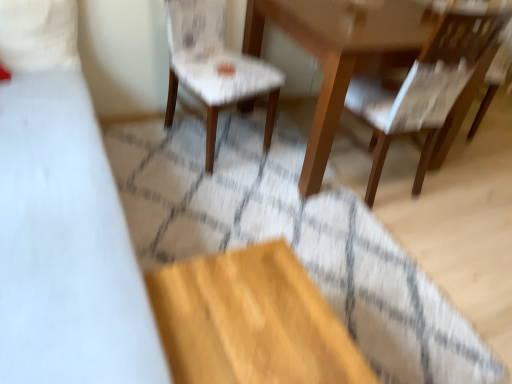
At what (x,y) coordinates should I click in order to perform the action: click on wooden chair at right, which ranks as the 1th chair in right-to-left order. Please return your answer as a coordinate pair (x, y). Image resolution: width=512 pixels, height=384 pixels. Looking at the image, I should click on (423, 88).

Measure the distance between point (x=461, y=55) and camera.

Point (x=461, y=55) is 1.72 meters away from camera.

Locate an element on the screen. matte yellow plywood at lower center is located at coordinates (250, 321).

Is matte yellow plywood at lower center aimed at white fabric chair at center, acting as the second chair starting from the right?

No.

Which is correct: matte yellow plywood at lower center is inside white fabric chair at center, which is the first chair from left to right, or outside of it?

matte yellow plywood at lower center lies outside white fabric chair at center, which is the first chair from left to right.

What's the angular difference between matte yellow plywood at lower center and white fabric chair at center, which is the first chair from left to right,'s facing directions?

matte yellow plywood at lower center and white fabric chair at center, which is the first chair from left to right, are facing 77.6 degrees away from each other.

Is point (188, 293) farther from camera compared to point (213, 59)?

No, it is not.

Does point (412, 36) come behind point (256, 350)?

Yes, point (412, 36) is behind point (256, 350).

I want to click on round table that appears above the matte yellow plywood at lower center (from a real-world perspective), so click(339, 54).

Does wooden table at center turn towards matte yellow plywood at lower center?

No.

How much distance is there between wooden table at center and matte yellow plywood at lower center?

wooden table at center and matte yellow plywood at lower center are 1.04 meters apart.

Is wooden table at center aimed at white fabric chair at center, which is the first chair from left to right?

No, wooden table at center is not facing towards white fabric chair at center, which is the first chair from left to right.

Which point is more forward, (354, 5) or (213, 94)?

The point (213, 94) is more forward.

Can we say wooden table at center lies outside white fabric chair at center, acting as the second chair starting from the right?

Absolutely, wooden table at center is external to white fabric chair at center, acting as the second chair starting from the right.

Are white fabric bed at left and matte yellow plywood at lower center beside each other?

No.

Is white fabric bed at left inside or outside of matte yellow plywood at lower center?

white fabric bed at left is located beyond the bounds of matte yellow plywood at lower center.

Between white fabric bed at left and matte yellow plywood at lower center, which one has smaller size?

Smaller between the two is matte yellow plywood at lower center.

Considering the positions of objects white fabric bed at left and matte yellow plywood at lower center in the image provided, who is more to the right, white fabric bed at left or matte yellow plywood at lower center?

Positioned to the right is matte yellow plywood at lower center.

Is point (420, 175) closer or farther from the camera than point (110, 308)?

Point (420, 175) is farther from the camera than point (110, 308).

Is wooden chair at right, which ranks as the 1th chair in right-to-left order, facing away from white fabric bed at left?

No, wooden chair at right, which ranks as the 1th chair in right-to-left order,'s orientation is not away from white fabric bed at left.

From a real-world perspective, which is physically above, wooden chair at right, which ranks as the 1th chair in right-to-left order, or white fabric bed at left?

wooden chair at right, which ranks as the 1th chair in right-to-left order, from a real-world perspective.

Would you say wooden chair at right, marked as the 2th chair in a left-to-right arrangement, is to the left or to the right of white fabric bed at left in the picture?

Based on their positions, wooden chair at right, marked as the 2th chair in a left-to-right arrangement, is located to the right of white fabric bed at left.

From a real-world perspective, does wooden chair at right, which ranks as the 1th chair in right-to-left order, sit lower than matte yellow plywood at lower center?

No, from a real-world perspective, wooden chair at right, which ranks as the 1th chair in right-to-left order, is not below matte yellow plywood at lower center.

Does wooden chair at right, marked as the 2th chair in a left-to-right arrangement, lie in front of matte yellow plywood at lower center?

No, the depth of wooden chair at right, marked as the 2th chair in a left-to-right arrangement, is greater than that of matte yellow plywood at lower center.

Is wooden chair at right, which ranks as the 1th chair in right-to-left order, wider or thinner than matte yellow plywood at lower center?

In the image, wooden chair at right, which ranks as the 1th chair in right-to-left order, appears to be wider than matte yellow plywood at lower center.

Is wooden chair at right, which ranks as the 1th chair in right-to-left order, turned away from matte yellow plywood at lower center?

No, wooden chair at right, which ranks as the 1th chair in right-to-left order,'s orientation is not away from matte yellow plywood at lower center.

Is wooden chair at right, which ranks as the 1th chair in right-to-left order, facing away from white fabric chair at center, acting as the second chair starting from the right?

wooden chair at right, which ranks as the 1th chair in right-to-left order, is not turned away from white fabric chair at center, acting as the second chair starting from the right.

Considering their positions, is wooden chair at right, which ranks as the 1th chair in right-to-left order, located in front of or behind white fabric chair at center, which is the first chair from left to right?

Visually, wooden chair at right, which ranks as the 1th chair in right-to-left order, is located in front of white fabric chair at center, which is the first chair from left to right.

Considering the relative positions of wooden chair at right, which ranks as the 1th chair in right-to-left order, and white fabric chair at center, which is the first chair from left to right, in the image provided, is wooden chair at right, which ranks as the 1th chair in right-to-left order, to the left of white fabric chair at center, which is the first chair from left to right, from the viewer's perspective?

No.

You are a GUI agent. You are given a task and a screenshot of the screen. Output one action in this format:
    pyautogui.click(x=<x>, y=<y>)
    Task: Click on the 2nd chair behind the matte yellow plywood at lower center, starting your count from the anchor
    This screenshot has width=512, height=384.
    Given the screenshot: What is the action you would take?
    pyautogui.click(x=214, y=67)

Where is `plywood on the left side of wooden table at center`? This screenshot has width=512, height=384. plywood on the left side of wooden table at center is located at coordinates (250, 321).

In the scene shown: From the image, which object appears to be nearer to wooden chair at right, marked as the 2th chair in a left-to-right arrangement, matte yellow plywood at lower center or wooden table at center?

wooden table at center is closer to wooden chair at right, marked as the 2th chair in a left-to-right arrangement.

Looking at the image, which one is located closer to white fabric bed at left, white fabric chair at center, acting as the second chair starting from the right, or wooden chair at right, which ranks as the 1th chair in right-to-left order?

The object closer to white fabric bed at left is white fabric chair at center, acting as the second chair starting from the right.

Considering their positions, is white fabric bed at left positioned closer to wooden table at center than matte yellow plywood at lower center?

The object closer to wooden table at center is matte yellow plywood at lower center.

When comparing their distances from white fabric bed at left, does wooden chair at right, marked as the 2th chair in a left-to-right arrangement, or white fabric chair at center, acting as the second chair starting from the right, seem further?

wooden chair at right, marked as the 2th chair in a left-to-right arrangement, is further to white fabric bed at left.

Based on their spatial positions, is wooden chair at right, marked as the 2th chair in a left-to-right arrangement, or matte yellow plywood at lower center closer to white fabric bed at left?

matte yellow plywood at lower center is positioned closer to the anchor white fabric bed at left.

Looking at the image, which one is located further to matte yellow plywood at lower center, wooden chair at right, marked as the 2th chair in a left-to-right arrangement, or white fabric chair at center, acting as the second chair starting from the right?

wooden chair at right, marked as the 2th chair in a left-to-right arrangement, is positioned further to the anchor matte yellow plywood at lower center.

From the picture: Looking at the image, which one is located further to white fabric chair at center, which is the first chair from left to right, matte yellow plywood at lower center or white fabric bed at left?

Among the two, matte yellow plywood at lower center is located further to white fabric chair at center, which is the first chair from left to right.

Based on their spatial positions, is wooden table at center or white fabric chair at center, which is the first chair from left to right, closer to matte yellow plywood at lower center?

Among the two, wooden table at center is located nearer to matte yellow plywood at lower center.

Locate an element on the screen. chair between wooden table at center and matte yellow plywood at lower center from top to bottom is located at coordinates click(423, 88).

This screenshot has width=512, height=384. Find the location of `round table between white fabric chair at center, which is the first chair from left to right, and wooden chair at right, which ranks as the 1th chair in right-to-left order`. round table between white fabric chair at center, which is the first chair from left to right, and wooden chair at right, which ranks as the 1th chair in right-to-left order is located at coordinates (339, 54).

Find the location of `chair between white fabric bed at left and white fabric chair at center, which is the first chair from left to right, in the front-back direction`. chair between white fabric bed at left and white fabric chair at center, which is the first chair from left to right, in the front-back direction is located at coordinates (423, 88).

Where is `plywood located between white fabric bed at left and wooden table at center in the depth direction`? This screenshot has width=512, height=384. plywood located between white fabric bed at left and wooden table at center in the depth direction is located at coordinates (250, 321).